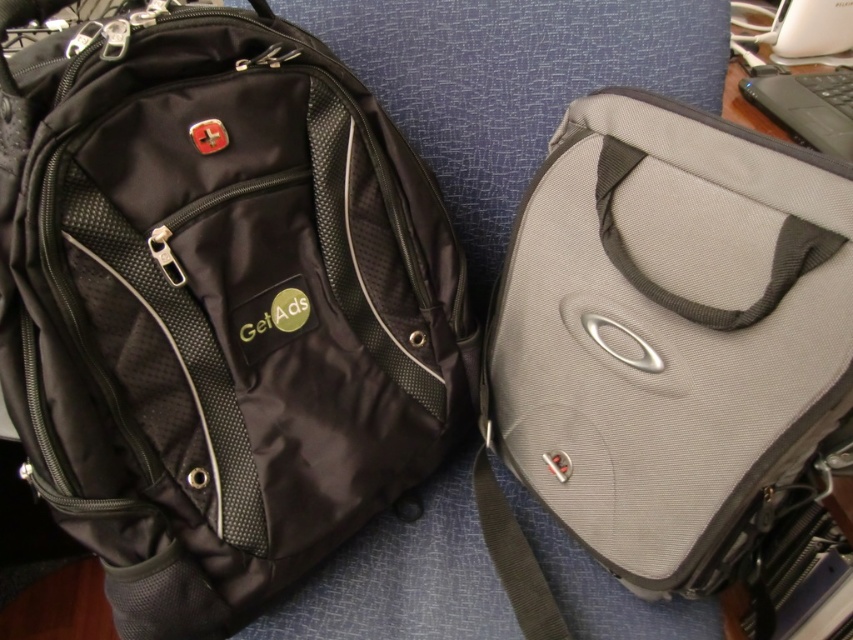
Between matte black backpack at left and black nylon strap at center, which one has less height?

Result: black nylon strap at center is shorter.

Is matte black backpack at left bigger than black nylon strap at center?

Correct, matte black backpack at left is larger in size than black nylon strap at center.

Is point (421, 371) positioned behind point (479, 456)?

That is False.

Locate an element on the screen. matte black backpack at left is located at coordinates (216, 304).

Which is more to the left, black nylon strap at center or black matte laptop at upper right?

black nylon strap at center is more to the left.

Does black nylon strap at center come in front of black matte laptop at upper right?

Yes, it is in front of black matte laptop at upper right.

Is point (515, 593) less distant than point (775, 74)?

Yes, it is.

Locate an element on the screen. This screenshot has width=853, height=640. black nylon strap at center is located at coordinates (514, 557).

Who is shorter, matte black backpack at left or gray fabric strap at center?

Standing shorter between the two is gray fabric strap at center.

Which is in front, point (421, 195) or point (819, 237)?

Point (819, 237) is more forward.

Is point (251, 349) farther from camera compared to point (761, 310)?

Yes.

At what (x,y) coordinates should I click in order to perform the action: click on matte black backpack at left. Please return your answer as a coordinate pair (x, y). Looking at the image, I should click on (216, 304).